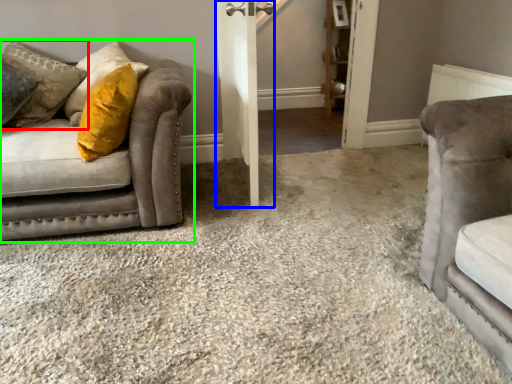
Question: Which is nearer to the pillow (highlighted by a red box)? barn door (highlighted by a blue box) or studio couch (highlighted by a green box).

Choices:
 (A) barn door
 (B) studio couch

Answer: (B)